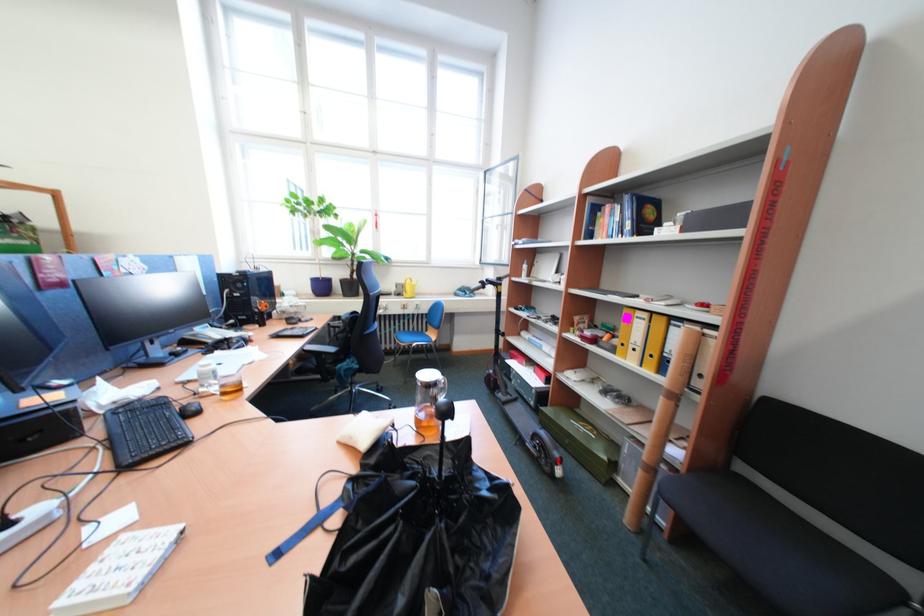
Where is `office chair armrest`? This screenshot has width=924, height=616. office chair armrest is located at coordinates pyautogui.click(x=808, y=512).